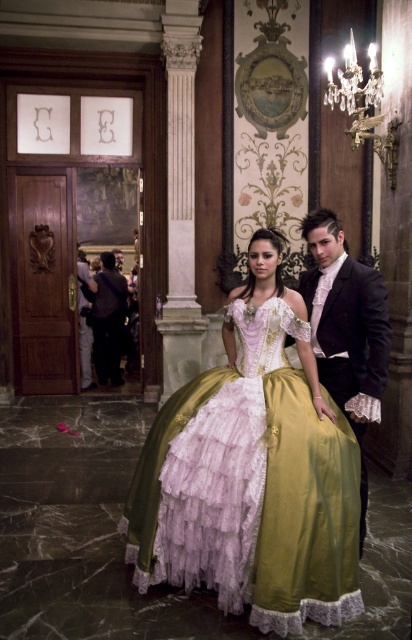
Can you confirm if lavender satin gown at center is positioned to the left of shiny black suit at center?

Indeed, lavender satin gown at center is positioned on the left side of shiny black suit at center.

Which is in front, point (213, 572) or point (334, 340)?

Point (213, 572) is in front.

Describe the element at coordinates (252, 481) in the screenshot. This screenshot has height=640, width=412. I see `lavender satin gown at center` at that location.

Find the location of `lavender satin gown at center`. lavender satin gown at center is located at coordinates (252, 481).

Can you confirm if lavender satin gown at center is smaller than dark purple fabric at left?

No.

Does lavender satin gown at center have a lesser width compared to dark purple fabric at left?

No.

You are a GUI agent. You are given a task and a screenshot of the screen. Output one action in this format:
    pyautogui.click(x=<x>, y=<y>)
    Task: Click on the lavender satin gown at center
    
    Given the screenshot: What is the action you would take?
    pyautogui.click(x=252, y=481)

Consider the image. Does shiny black suit at center have a greater width compared to dark purple fabric at left?

Incorrect, shiny black suit at center's width does not surpass dark purple fabric at left's.

Who is taller, shiny black suit at center or dark purple fabric at left?

shiny black suit at center is taller.

Where is `shiny black suit at center`? shiny black suit at center is located at coordinates (346, 321).